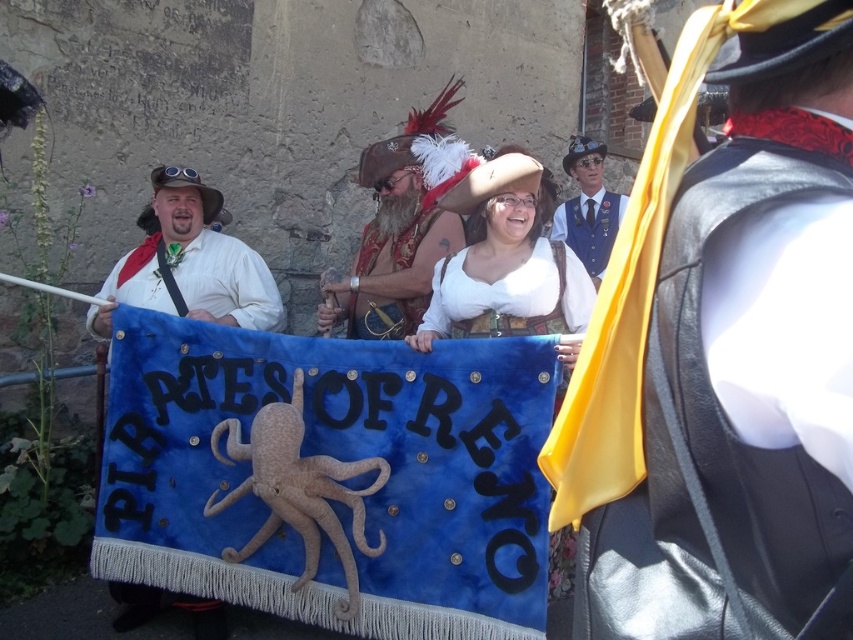
Consider the image. Which of these two, leather vest at center or blue velvet vest at upper center, stands taller?

blue velvet vest at upper center is taller.

Locate an element on the screen. leather vest at center is located at coordinates (723, 352).

You are a GUI agent. You are given a task and a screenshot of the screen. Output one action in this format:
    pyautogui.click(x=<x>, y=<y>)
    Task: Click on the leather vest at center
    The image size is (853, 640).
    Given the screenshot: What is the action you would take?
    pyautogui.click(x=723, y=352)

Is white satin blouse at center wider than velvet pirate hat at center?

Correct, the width of white satin blouse at center exceeds that of velvet pirate hat at center.

Does point (497, 282) come behind point (403, 246)?

No, (497, 282) is closer to viewer.

Measure the distance between point (486, 282) and camera.

They are 3.83 meters apart.

Find the location of a particular element. This screenshot has width=853, height=640. white satin blouse at center is located at coordinates point(508,266).

The width and height of the screenshot is (853, 640). What do you see at coordinates (190, 264) in the screenshot? I see `matte white shirt at center` at bounding box center [190, 264].

Is matte white shirt at center positioned at the back of blue velvet vest at upper center?

No, matte white shirt at center is closer to the viewer.

Is point (187, 275) positioned before point (581, 179)?

That is True.

Locate an element on the screen. matte white shirt at center is located at coordinates (190, 264).